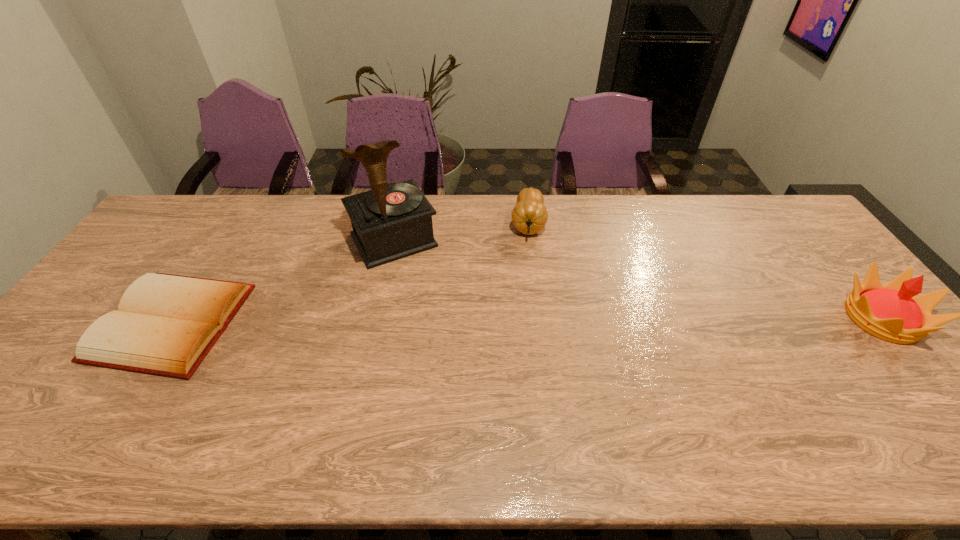
Find the location of a particular element. Image resolution: width=960 pixels, height=540 pixels. Bible is located at coordinates (166, 324).

Where is `the shortest object`? The width and height of the screenshot is (960, 540). the shortest object is located at coordinates (166, 324).

Locate an element on the screen. This screenshot has width=960, height=540. crown is located at coordinates (892, 312).

Where is `the third shortest object`? the third shortest object is located at coordinates (892, 312).

Where is `phonograph_record`? The height and width of the screenshot is (540, 960). phonograph_record is located at coordinates (392, 221).

At what (x,y) coordinates should I click in order to perform the action: click on the second object from left to right. Please return your answer as a coordinate pair (x, y). Looking at the image, I should click on (392, 221).

Find the location of a particular element. The height and width of the screenshot is (540, 960). gourd is located at coordinates (529, 215).

I want to click on the second shortest object, so click(529, 215).

Locate an element on the screen. The height and width of the screenshot is (540, 960). free location located on the back of the Bible is located at coordinates (249, 201).

The image size is (960, 540). In order to click on vacant area situated on the back of the second tallest object in this screenshot , I will do `click(814, 237)`.